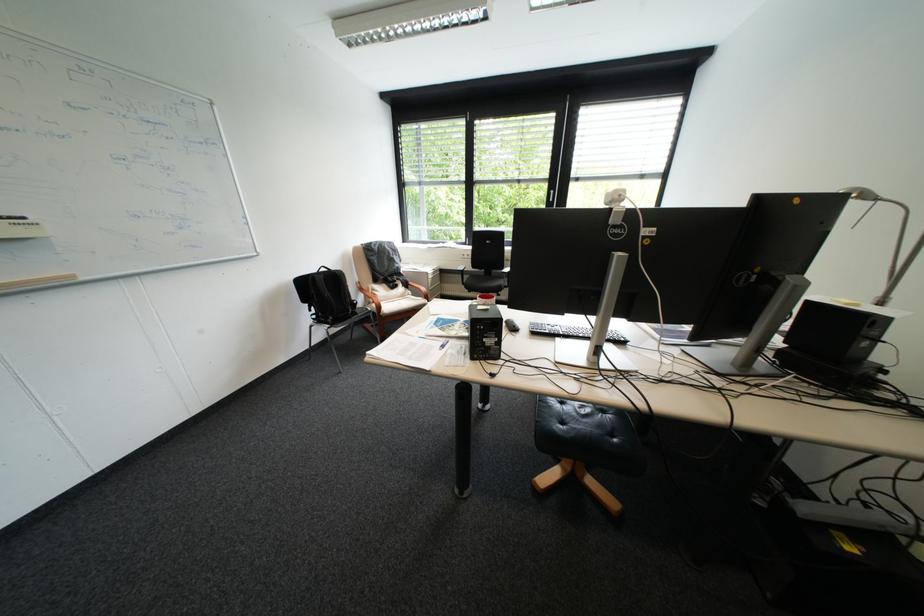
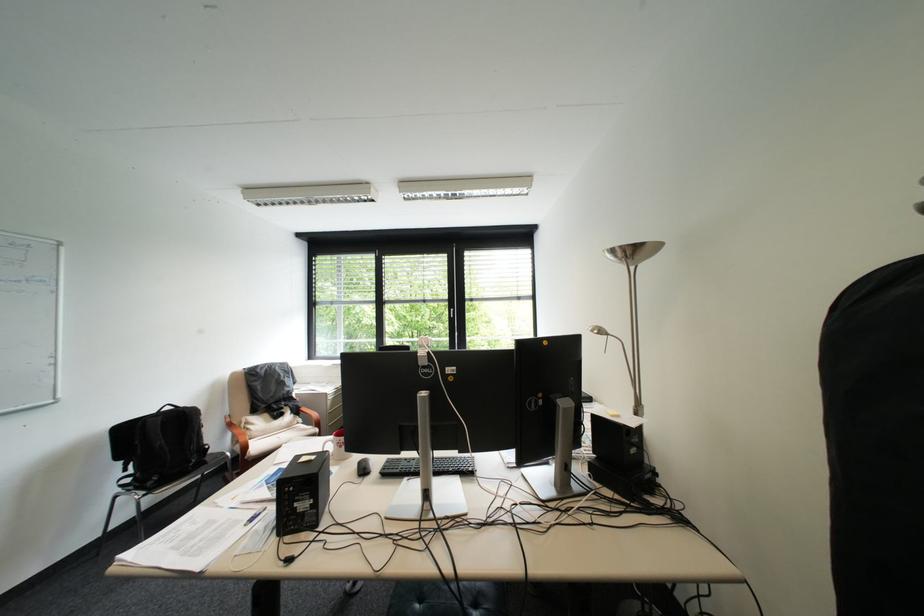
In the second image, find the point that corresponds to (x=347, y=273) in the first image.

(198, 411)